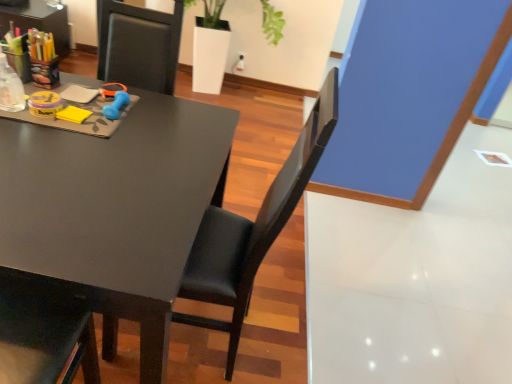
Describe the element at coordinates (112, 89) in the screenshot. The height and width of the screenshot is (384, 512). I see `blue plastic scissors at upper center` at that location.

Where is `white glossy planter at upper center`? The width and height of the screenshot is (512, 384). white glossy planter at upper center is located at coordinates (272, 23).

You are a GUI agent. You are given a task and a screenshot of the screen. Output one action in this format:
    pyautogui.click(x=<x>, y=<y>)
    Task: Click on the matte black desk at left
    Image resolution: width=512 pixels, height=384 pixels.
    Given the screenshot: What is the action you would take?
    pyautogui.click(x=113, y=210)

In the scene shown: Between blue plastic scissors at upper center and white glossy planter at upper center, which one appears on the right side from the viewer's perspective?

white glossy planter at upper center.

Does blue plastic scissors at upper center touch white glossy planter at upper center?

There is a gap between blue plastic scissors at upper center and white glossy planter at upper center.

In terms of height, does blue plastic scissors at upper center look taller or shorter compared to white glossy planter at upper center?

blue plastic scissors at upper center is shorter than white glossy planter at upper center.

From the image's perspective, is black leather chair at center under blue plastic scissors at upper center?

Indeed, from the image's perspective, black leather chair at center is shown beneath blue plastic scissors at upper center.

Can you confirm if black leather chair at center is thinner than blue plastic scissors at upper center?

In fact, black leather chair at center might be wider than blue plastic scissors at upper center.

Which of these two, black leather chair at center or blue plastic scissors at upper center, is smaller?

Smaller between the two is blue plastic scissors at upper center.

Which is less distant, (153, 144) or (110, 86)?

Point (153, 144)

Which object is wider, matte black desk at left or blue plastic scissors at upper center?

matte black desk at left is wider.

Would you say matte black desk at left is inside or outside blue plastic scissors at upper center?

matte black desk at left is outside blue plastic scissors at upper center.

Is matte black desk at left next to blue plastic scissors at upper center and touching it?

There is a gap between matte black desk at left and blue plastic scissors at upper center.

Which of these two, white glossy planter at upper center or blue plastic scissors at upper center, stands taller?

With more height is white glossy planter at upper center.

Who is more distant, white glossy planter at upper center or blue plastic scissors at upper center?

white glossy planter at upper center is further from the camera.

Is point (271, 39) farther from viewer compared to point (126, 89)?

Yes.

Considering their positions, is blue plastic scissors at upper center located in front of or behind black leather chair at center?

Clearly, blue plastic scissors at upper center is behind black leather chair at center.

Is there a large distance between blue plastic scissors at upper center and black leather chair at center?

No, there isn't a large distance between blue plastic scissors at upper center and black leather chair at center.

Based on the photo, considering the sizes of blue plastic scissors at upper center and black leather chair at center in the image, is blue plastic scissors at upper center wider or thinner than black leather chair at center?

blue plastic scissors at upper center is thinner than black leather chair at center.

Does point (101, 287) come farther from viewer compared to point (208, 12)?

No, it is not.

Can you tell me how much matte black desk at left and white glossy planter at upper center differ in facing direction?

The angle between the facing direction of matte black desk at left and the facing direction of white glossy planter at upper center is 89 degrees.

Does matte black desk at left come behind white glossy planter at upper center?

No, matte black desk at left is closer to the camera.

Which of these two, matte black desk at left or black leather chair at center, is thinner?

Thinner between the two is black leather chair at center.

From the image's perspective, between matte black desk at left and black leather chair at center, which one is located above?

black leather chair at center.

Would you say matte black desk at left is a long distance from black leather chair at center?

No, matte black desk at left is not far away from black leather chair at center.

At what (x,y) coordinates should I click in order to perform the action: click on houseplant that is behind the blue plastic scissors at upper center. Please return your answer as a coordinate pair (x, y). Looking at the image, I should click on (272, 23).

Locate an element on the screen. The width and height of the screenshot is (512, 384). chair to the right of blue plastic scissors at upper center is located at coordinates (252, 230).

When comparing their distances from white glossy planter at upper center, does matte black desk at left or black leather chair at center seem further?

black leather chair at center lies further to white glossy planter at upper center than the other object.

Based on their spatial positions, is blue plastic scissors at upper center or matte black desk at left closer to black leather chair at center?

matte black desk at left is positioned closer to the anchor black leather chair at center.

When comparing their distances from black leather chair at center, does white glossy planter at upper center or blue plastic scissors at upper center seem further?

Based on the image, white glossy planter at upper center appears to be further to black leather chair at center.

Considering their positions, is matte black desk at left positioned closer to black leather chair at center than blue plastic scissors at upper center?

matte black desk at left.

From the image, which object appears to be nearer to blue plastic scissors at upper center, black leather chair at center or white glossy planter at upper center?

Answer: Based on the image, black leather chair at center appears to be nearer to blue plastic scissors at upper center.

Considering their positions, is white glossy planter at upper center positioned further to blue plastic scissors at upper center than matte black desk at left?

The object further to blue plastic scissors at upper center is white glossy planter at upper center.

Considering their positions, is black leather chair at center positioned closer to matte black desk at left than white glossy planter at upper center?

Based on the image, black leather chair at center appears to be nearer to matte black desk at left.

Looking at the image, which one is located further to white glossy planter at upper center, black leather chair at center or blue plastic scissors at upper center?

The object further to white glossy planter at upper center is black leather chair at center.

Locate an element on the screen. The image size is (512, 384). desk between black leather chair at center and white glossy planter at upper center from front to back is located at coordinates (113, 210).

You are a GUI agent. You are given a task and a screenshot of the screen. Output one action in this format:
    pyautogui.click(x=<x>, y=<y>)
    Task: Click on the scissors between matte black desk at left and white glossy planter at upper center from front to back
    This screenshot has width=512, height=384.
    Given the screenshot: What is the action you would take?
    pyautogui.click(x=112, y=89)

The width and height of the screenshot is (512, 384). I want to click on desk between black leather chair at center and blue plastic scissors at upper center along the z-axis, so click(x=113, y=210).

What are the coordinates of `scissors between black leather chair at center and white glossy planter at upper center in the front-back direction` in the screenshot? It's located at tap(112, 89).